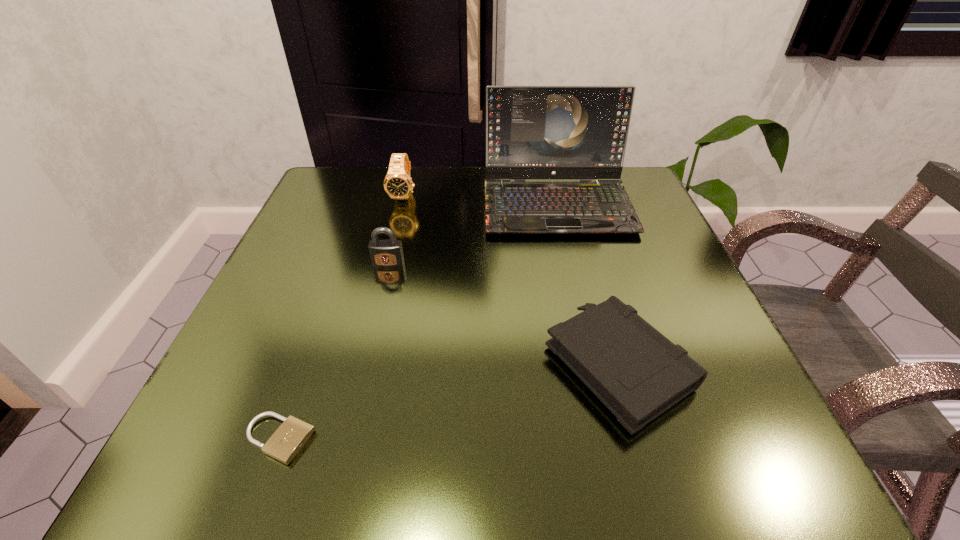
This screenshot has height=540, width=960. Find the location of `empty space between the tallest object and the shorter padlock`. empty space between the tallest object and the shorter padlock is located at coordinates (418, 322).

Find the location of a particular element. The width and height of the screenshot is (960, 540). free space between the laptop computer and the left padlock is located at coordinates (418, 322).

Locate an element on the screen. This screenshot has height=540, width=960. vacant space that's between the nearer padlock and the fourth tallest object is located at coordinates click(x=449, y=402).

Identify the location of free spot between the fourth shortest object and the Bible. (512, 280).

The width and height of the screenshot is (960, 540). Find the location of `free space between the left padlock and the farther padlock`. free space between the left padlock and the farther padlock is located at coordinates (333, 351).

Find the location of a particular element. The height and width of the screenshot is (540, 960). free space between the third shortest object and the laptop computer is located at coordinates (472, 234).

Identify the location of vacant region between the fourth tallest object and the farther padlock. The image size is (960, 540). (503, 314).

This screenshot has width=960, height=540. I want to click on empty space between the second shortest object and the shortest object, so click(x=449, y=402).

I want to click on free space between the second shortest object and the third nearest object, so click(503, 314).

Locate which object is the fourth closest to the right padlock. Please provide its 2D coordinates. Your answer should be formatted as a tuple, i.e. [(x, y)], where the tuple contains the x and y coordinates of a point satisfying the conditions above.

[(286, 442)]